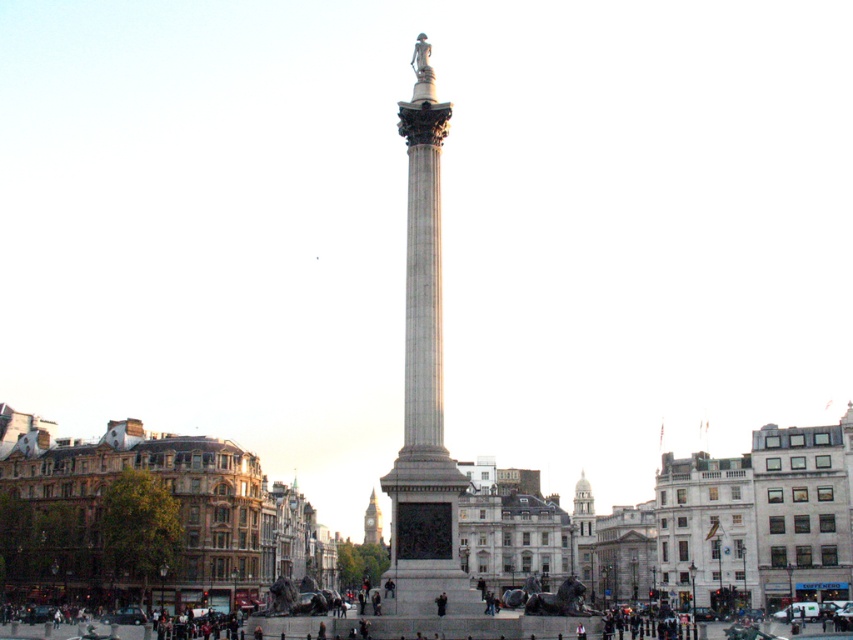
Is smooth stone column at center above white stone tower at center?

Indeed, smooth stone column at center is positioned over white stone tower at center.

Is smooth stone column at center shorter than white stone tower at center?

No, smooth stone column at center is not shorter than white stone tower at center.

You are a GUI agent. You are given a task and a screenshot of the screen. Output one action in this format:
    pyautogui.click(x=<x>, y=<y>)
    Task: Click on the smooth stone column at center
    The height and width of the screenshot is (640, 853).
    Given the screenshot: What is the action you would take?
    pyautogui.click(x=424, y=385)

Can you confirm if smooth stone monument at center is positioned to the left of smooth stone column at center?

Yes, smooth stone monument at center is to the left of smooth stone column at center.

Who is more forward, (x=648, y=548) or (x=434, y=346)?

Positioned in front is point (x=434, y=346).

Between point (154, 454) and point (424, 515), which one is positioned in front?

Point (424, 515)

Where is `smooth stone monument at center`? This screenshot has width=853, height=640. smooth stone monument at center is located at coordinates (697, 529).

Describe the element at coordinates (424, 385) in the screenshot. This screenshot has height=640, width=853. I see `smooth stone column at center` at that location.

Between smooth stone column at center and golden stone clock tower at center, which one has less height?

golden stone clock tower at center is shorter.

Describe the element at coordinates (424, 385) in the screenshot. I see `smooth stone column at center` at that location.

This screenshot has height=640, width=853. Identify the location of smooth stone column at center. (424, 385).